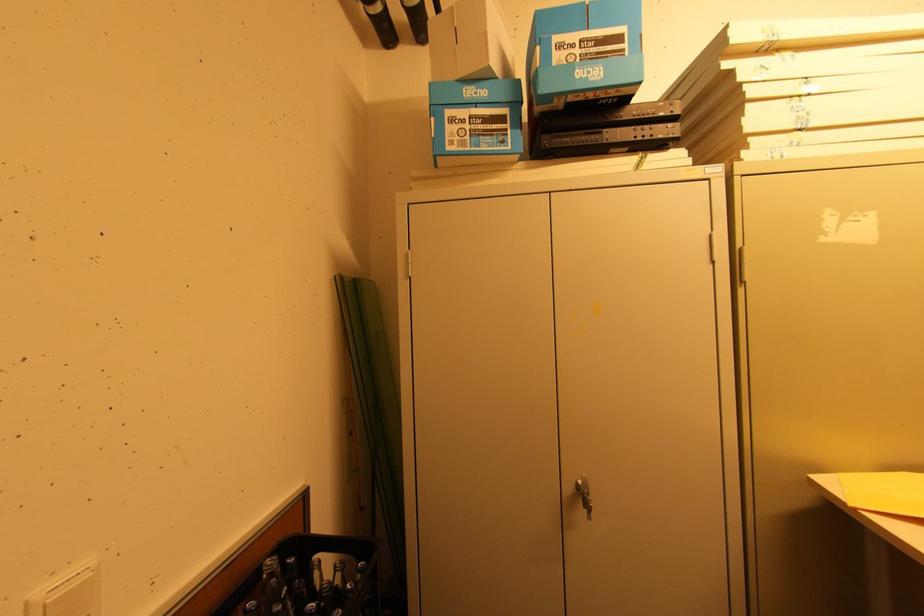
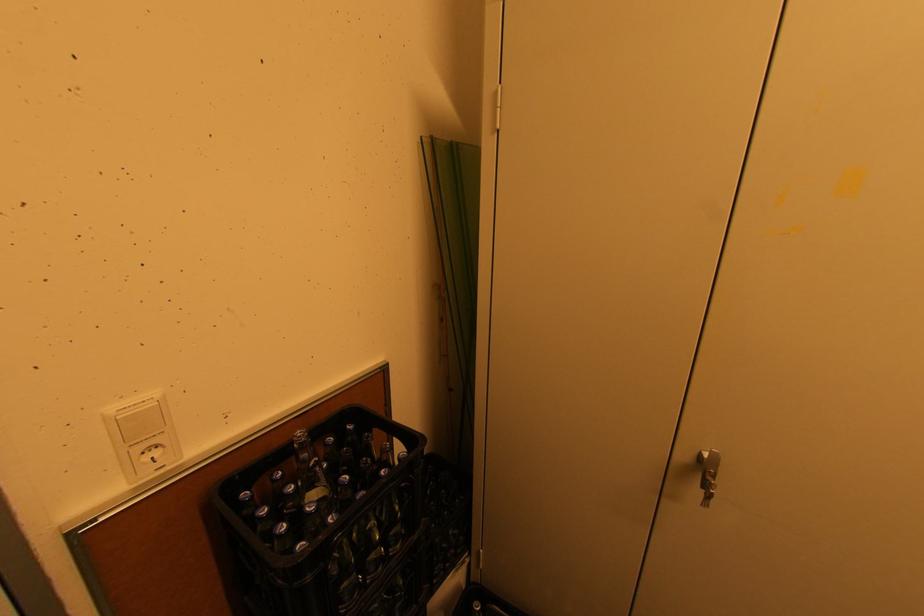
Based on the continuous images, in which direction is the camera rotating?

The camera's rotation is toward left-down.